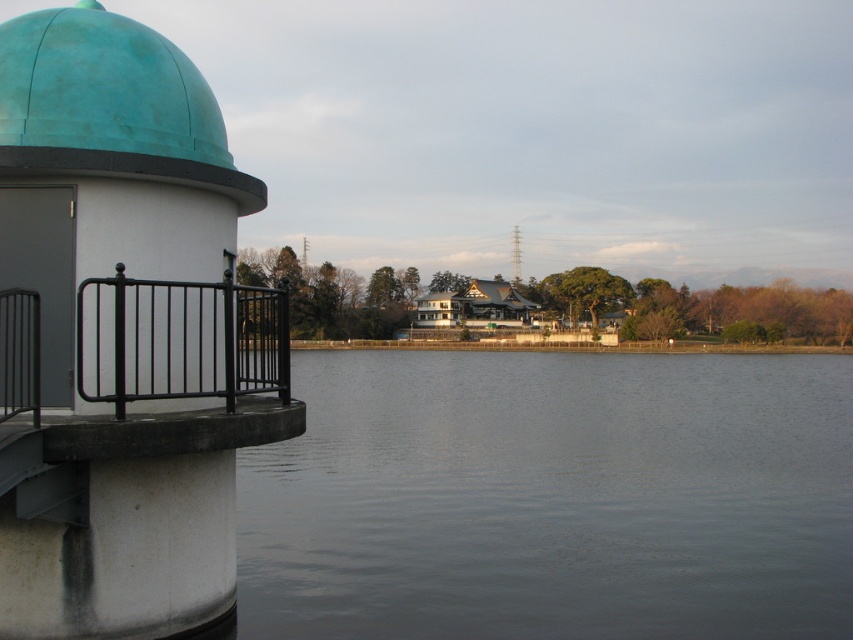
Question: Which of the following is the closest to the observer?

Choices:
 (A) dark gray water at center
 (B) black wrought iron railing at left

Answer: (B)

Question: Among these points, which one is farthest from the camera?

Choices:
 (A) (515, 264)
 (B) (97, 320)
 (C) (85, 381)

Answer: (A)

Question: Considering the relative positions of dark gray water at center and metallic gray tower at center in the image provided, where is dark gray water at center located with respect to metallic gray tower at center?

Choices:
 (A) above
 (B) below

Answer: (B)

Question: From the image, what is the correct spatial relationship of dark gray water at center in relation to matte white pillar at left?

Choices:
 (A) left
 (B) right

Answer: (B)

Question: Considering the relative positions of black wrought iron railing at left and metallic gray tower at center in the image provided, where is black wrought iron railing at left located with respect to metallic gray tower at center?

Choices:
 (A) above
 (B) below

Answer: (B)

Question: Estimate the real-world distances between objects in this image. Which object is farther from the metallic gray tower at center?

Choices:
 (A) dark gray water at center
 (B) black wrought iron railing at left
 (C) teal matte dome at upper left

Answer: (B)